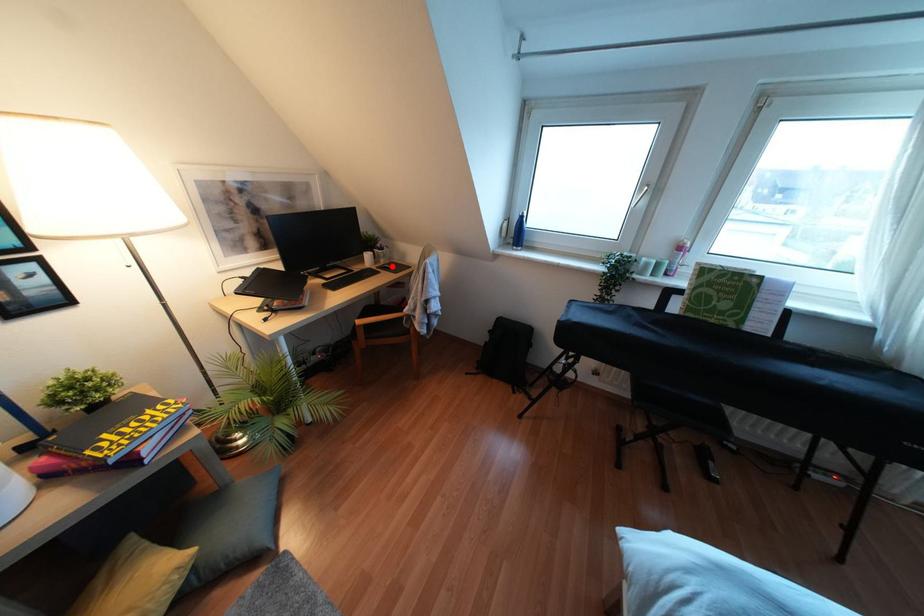
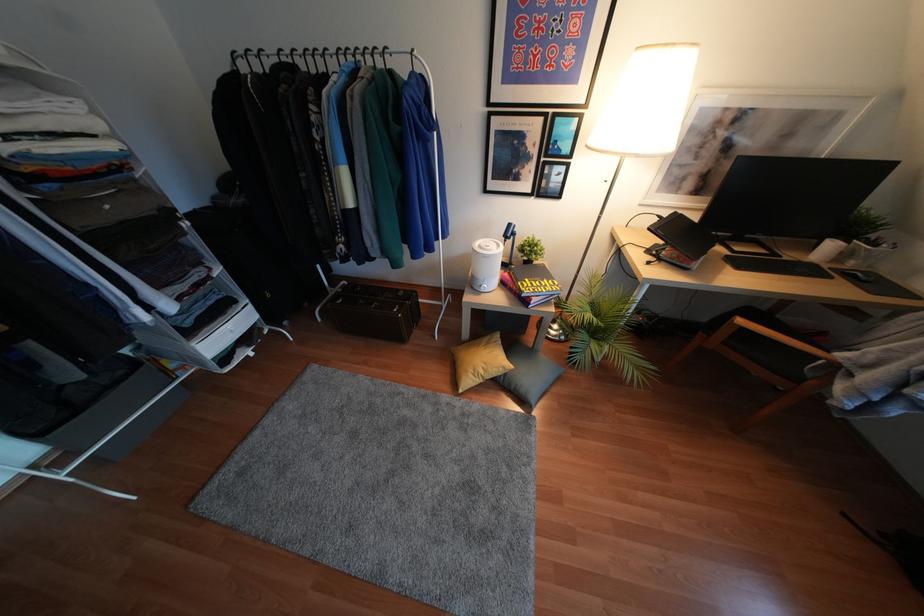
Question: I am providing you with two images of the same scene from different viewpoints. A red point is shown in image1. For the corresponding object point in image2, is it positioned nearer or farther from the camera?

Choices:
 (A) Nearer
 (B) Farther

Answer: (B)